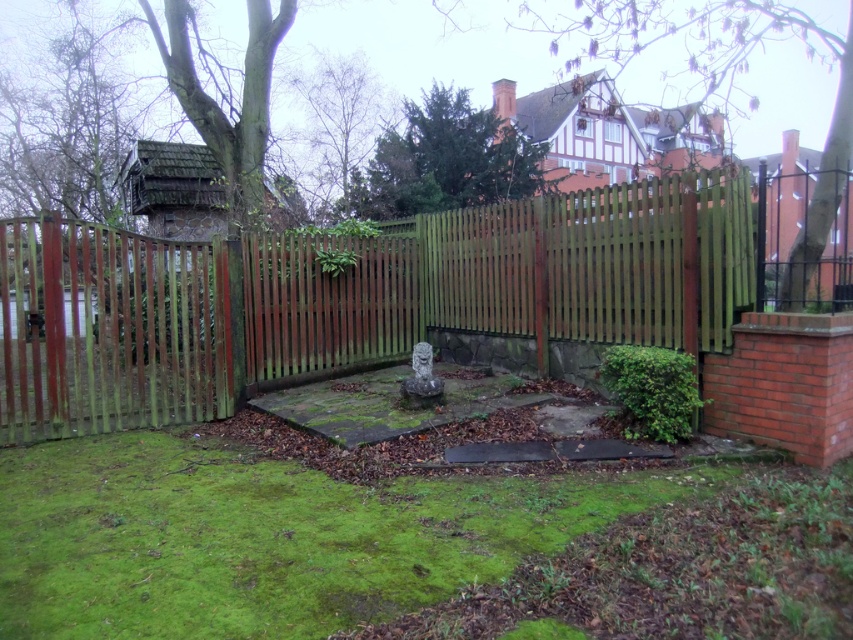
In the scene shown: You are a gardener who wants to place a 6.5 feet wide decorative bench between the green wooden fence at center and the green mossy grass at center. Can you fit it there?

The distance between the green wooden fence at center and the green mossy grass at center is 7.50 feet. Since the bench is 6.5 feet wide, it can fit within the available space as 6.5 is less than 7.5.

You are designing a garden layout and want to place a 10 cm wide decorative stone path between the green wooden fence at center and the green mossy grass at center. Is the space between them wide enough for this path?

The green wooden fence at center is thinner than the green mossy grass at center, so the space between them may be sufficient for a 10 cm wide path. However, without exact measurements, it is recommended to measure the gap before placing the path to ensure proper fit.